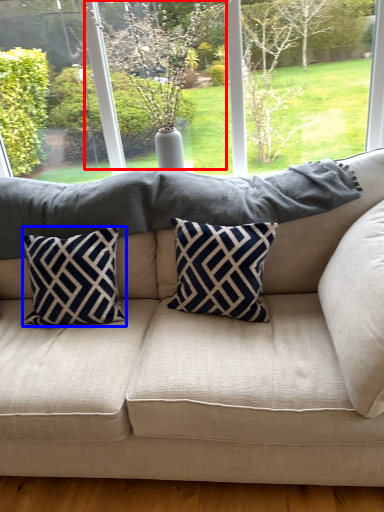
Question: Which point is further to the camera, tree (highlighted by a red box) or pillow (highlighted by a blue box)?

Choices:
 (A) tree
 (B) pillow

Answer: (A)